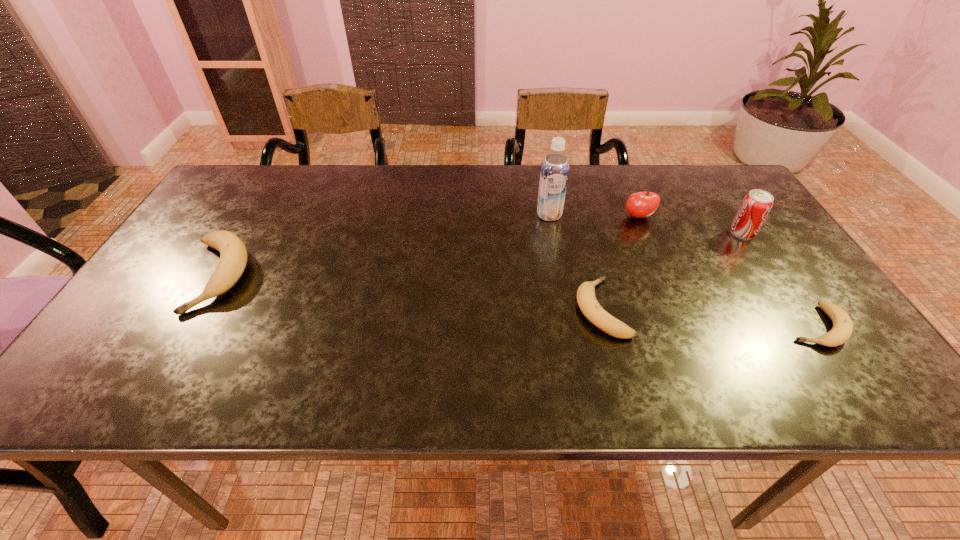
Where is `banana at the right edge`? The height and width of the screenshot is (540, 960). banana at the right edge is located at coordinates (842, 329).

Find the location of a particular element. Image resolution: width=960 pixels, height=540 pixels. soda can at the right edge is located at coordinates (756, 205).

Locate an element on the screen. The image size is (960, 540). object that is at the near right corner is located at coordinates [x=842, y=329].

Identify the location of vacant space at the far edge. (390, 178).

Image resolution: width=960 pixels, height=540 pixels. What are the coordinates of `vacant space at the near edge` in the screenshot? It's located at (774, 354).

I want to click on vacant space at the right edge of the desktop, so click(777, 292).

You are a GUI agent. You are given a task and a screenshot of the screen. Output one action in this format:
    pyautogui.click(x=<x>, y=<y>)
    Task: Click on the vacant area at the far right corner of the desktop
    The image size is (960, 540).
    Given the screenshot: What is the action you would take?
    pyautogui.click(x=734, y=194)

This screenshot has height=540, width=960. What are the coordinates of `free space that is in between the tallest banana and the apple` in the screenshot? It's located at (427, 246).

This screenshot has width=960, height=540. What are the coordinates of `vacant space in between the tallest object and the shortest banana` in the screenshot? It's located at (683, 271).

Where is `empty space between the shortest object and the apple`? empty space between the shortest object and the apple is located at coordinates (727, 271).